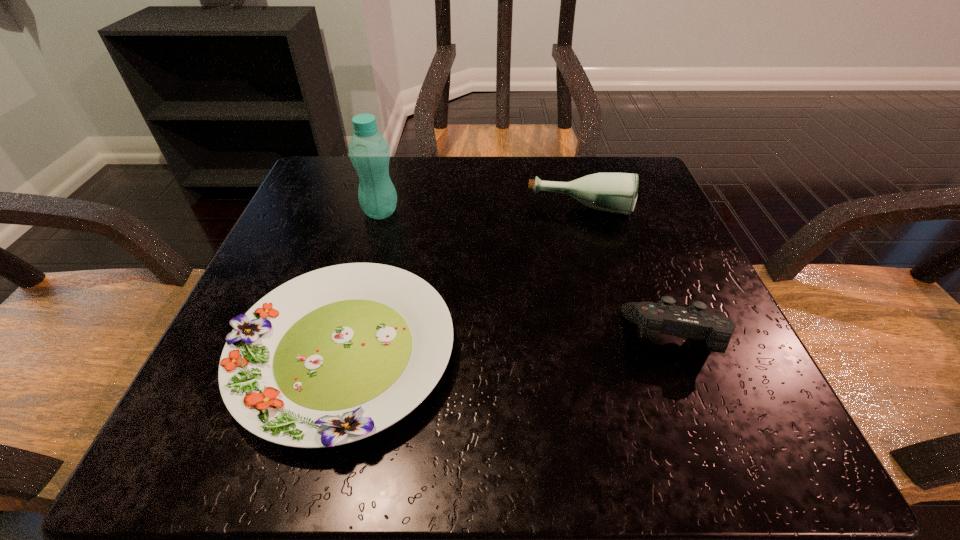
At what (x,y) coordinates should I click in order to perform the action: click on bottle at the left edge. Please return your answer as a coordinate pair (x, y). Looking at the image, I should click on pos(369,152).

Find the location of a particular element. salad plate present at the left edge is located at coordinates (335, 355).

I want to click on bottle at the right edge, so click(612, 192).

This screenshot has height=540, width=960. Identify the location of control located in the right edge section of the desktop. (694, 322).

Find the location of `object at the far left corner`. object at the far left corner is located at coordinates (369, 152).

Find the location of `object that is positioned at the near left corner`. object that is positioned at the near left corner is located at coordinates (335, 355).

At what (x,y) coordinates should I click in order to perform the action: click on object at the far right corner. Please return your answer as a coordinate pair (x, y). Looking at the image, I should click on (612, 192).

In the image, there is a desktop. Where is `free space at the far edge`? free space at the far edge is located at coordinates coord(439,186).

Image resolution: width=960 pixels, height=540 pixels. I want to click on vacant space at the near edge, so click(519, 462).

I want to click on blank space at the left edge, so click(296, 252).